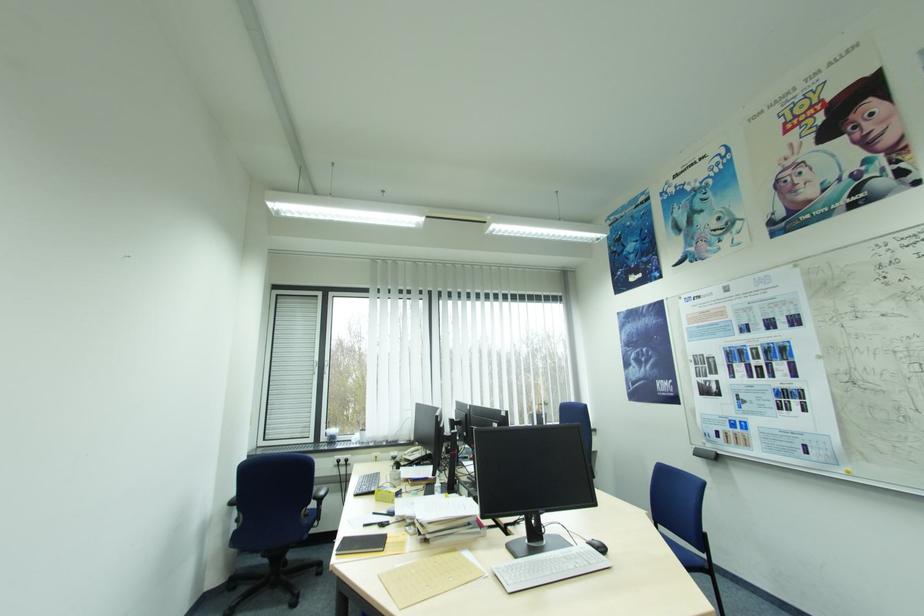
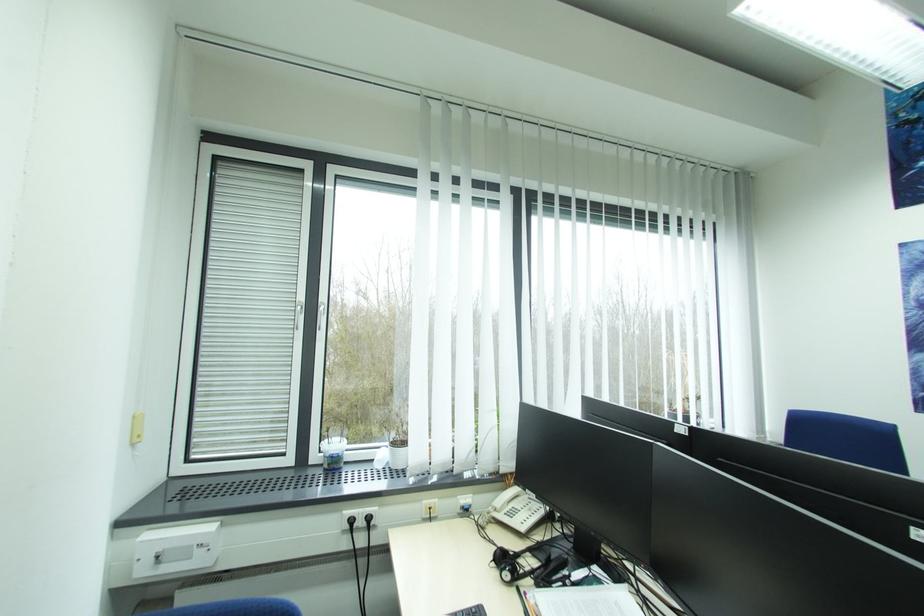
In a continuous first-person perspective shot, in which direction is the camera moving?

The movement direction of the cameraman is left, forward.